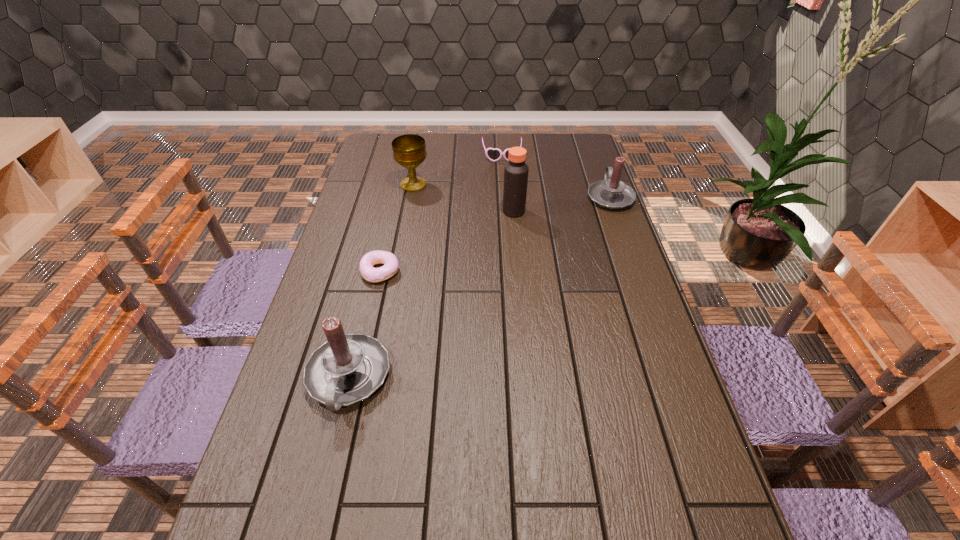
To achieve uniform spacing by inserting another candle among them, please point to a free space for this new candle. Please provide its 2D coordinates. Your answer should be formatted as a tuple, i.e. [(x, y)], where the tuple contains the x and y coordinates of a point satisfying the conditions above.

[(505, 269)]